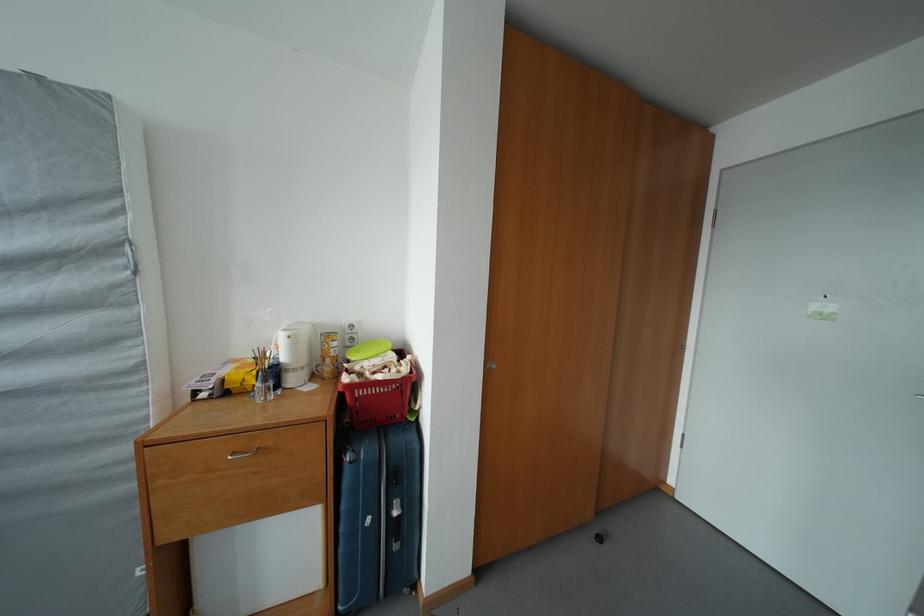
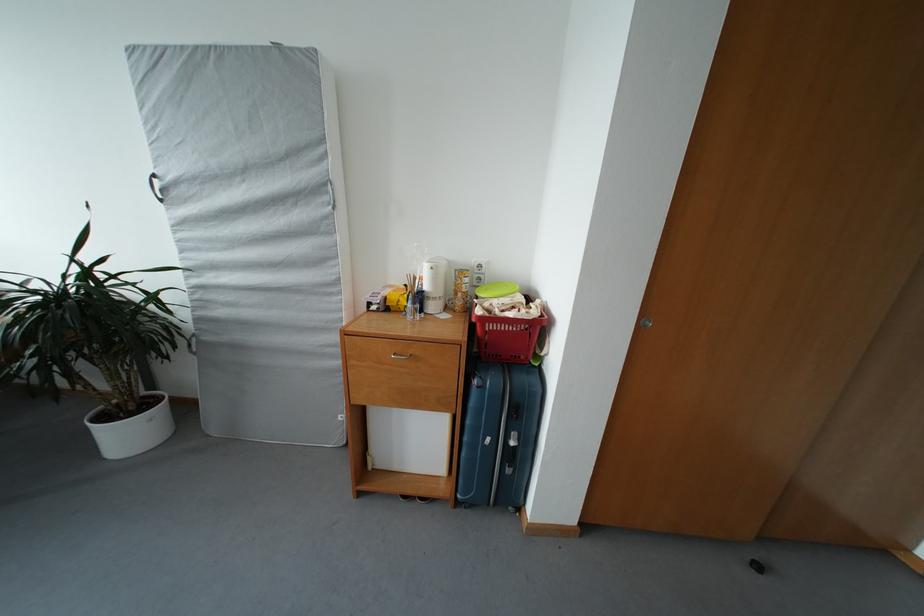
The point at (347, 554) is marked in the first image. Where is the corresponding point in the second image?

(469, 459)